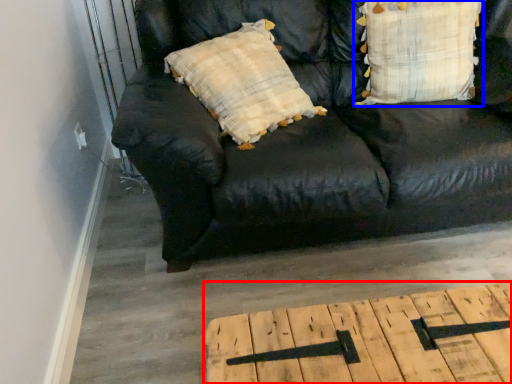
Question: Which object is further to the camera taking this photo, table (highlighted by a red box) or pillow (highlighted by a blue box)?

Choices:
 (A) table
 (B) pillow

Answer: (B)